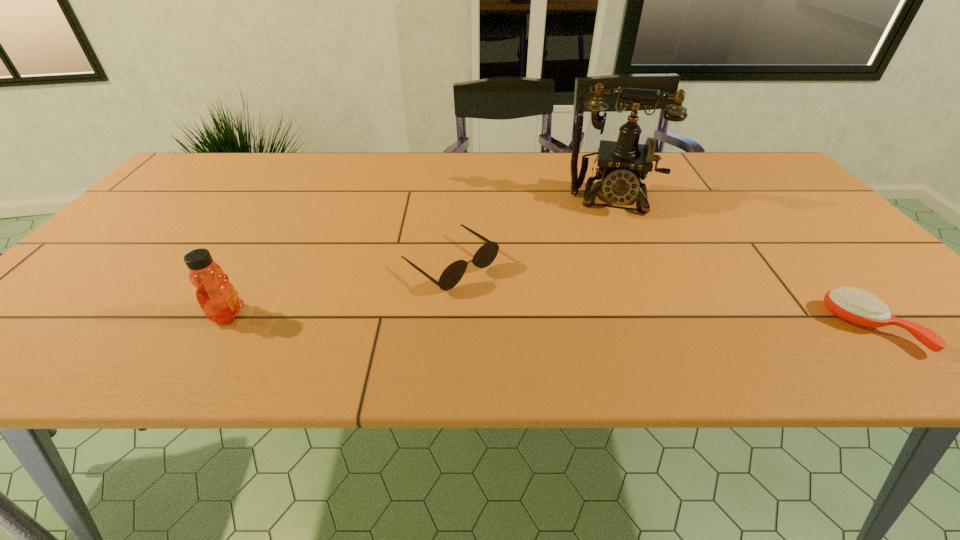
Locate an element on the screen. The width and height of the screenshot is (960, 540). vacant spot on the desktop that is between the leftmost object and the rightmost object and is positioned on the rotary dial of the third object from left to right is located at coordinates (607, 322).

Locate an element on the screen. The width and height of the screenshot is (960, 540). free space on the desktop that is between the honey and the rightmost object and is positioned on the front-facing side of the third tallest object is located at coordinates (528, 321).